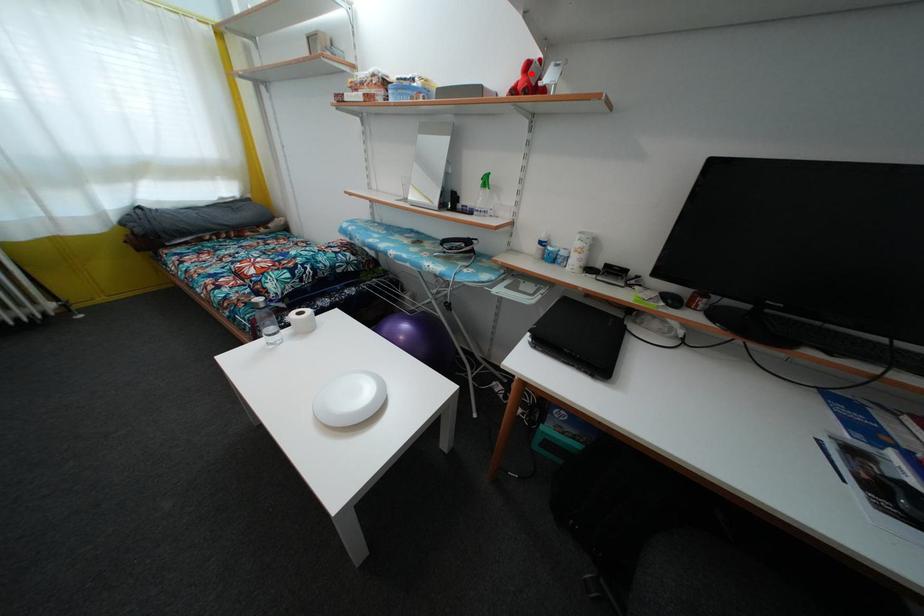
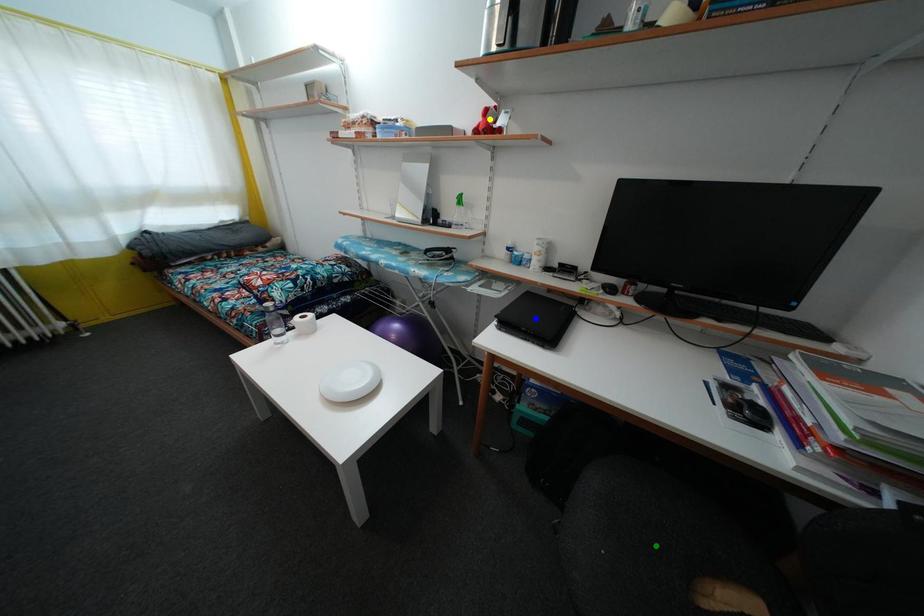
Question: I am providing you with two images of the same scene from different viewpoints. A red point is marked on the first image. You are given multiple points on the second image. Which spot in image 2 lines up with the point in image 1?

Choices:
 (A) blue point
 (B) green point
 (C) yellow point

Answer: (C)